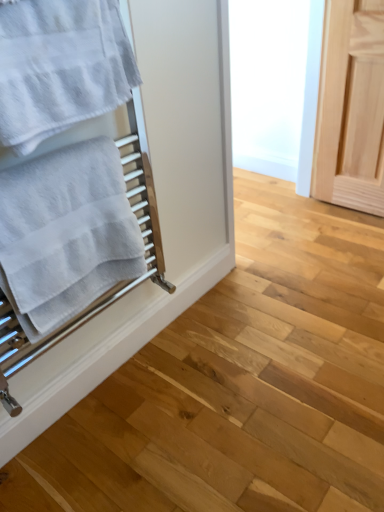
Question: Can you confirm if white cotton towel at left, which is the 1th towel in bottom-to-top order, is thinner than white textured towel at left, the 2th towel in the bottom-to-top sequence?

Choices:
 (A) no
 (B) yes

Answer: (A)

Question: From the image's perspective, is white cotton towel at left, which is the 2th towel from top to bottom, on white textured towel at left, the 2th towel in the bottom-to-top sequence?

Choices:
 (A) yes
 (B) no

Answer: (B)

Question: Does white cotton towel at left, which is the 2th towel from top to bottom, have a lesser height compared to white textured towel at left, the 2th towel in the bottom-to-top sequence?

Choices:
 (A) no
 (B) yes

Answer: (A)

Question: Can you confirm if white cotton towel at left, which is the 1th towel in bottom-to-top order, is smaller than white textured towel at left, which ranks as the first towel in top-to-bottom order?

Choices:
 (A) yes
 (B) no

Answer: (B)

Question: Is white cotton towel at left, which is the 1th towel in bottom-to-top order, next to white textured towel at left, which ranks as the first towel in top-to-bottom order?

Choices:
 (A) no
 (B) yes

Answer: (A)

Question: Is white cotton towel at left, which is the 1th towel in bottom-to-top order, positioned beyond the bounds of white textured towel at left, which ranks as the first towel in top-to-bottom order?

Choices:
 (A) no
 (B) yes

Answer: (B)

Question: Considering the relative sizes of white textured towel at left, which ranks as the first towel in top-to-bottom order, and white cotton towel at left, which is the 2th towel from top to bottom, in the image provided, is white textured towel at left, which ranks as the first towel in top-to-bottom order, shorter than white cotton towel at left, which is the 2th towel from top to bottom,?

Choices:
 (A) no
 (B) yes

Answer: (B)

Question: From a real-world perspective, is white textured towel at left, the 2th towel in the bottom-to-top sequence, located beneath white cotton towel at left, which is the 2th towel from top to bottom?

Choices:
 (A) no
 (B) yes

Answer: (A)

Question: Is white textured towel at left, which ranks as the first towel in top-to-bottom order, wider than white cotton towel at left, which is the 2th towel from top to bottom?

Choices:
 (A) yes
 (B) no

Answer: (B)

Question: From a real-world perspective, is white textured towel at left, the 2th towel in the bottom-to-top sequence, on white cotton towel at left, which is the 1th towel in bottom-to-top order?

Choices:
 (A) yes
 (B) no

Answer: (A)

Question: Can you confirm if white textured towel at left, which ranks as the first towel in top-to-bottom order, is positioned to the left of white cotton towel at left, which is the 1th towel in bottom-to-top order?

Choices:
 (A) no
 (B) yes

Answer: (A)

Question: In terms of size, does white cotton towel at left, which is the 2th towel from top to bottom, appear bigger or smaller than white textured towel at left, which ranks as the first towel in top-to-bottom order?

Choices:
 (A) small
 (B) big

Answer: (B)